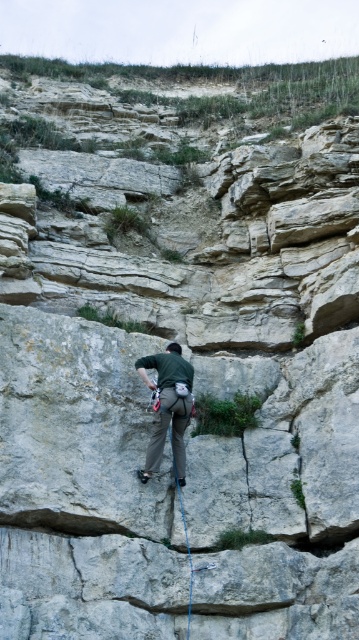
Question: Is green fabric climbing harness at center in front of blue nylon rope at center?

Choices:
 (A) no
 (B) yes

Answer: (A)

Question: Is green fabric climbing harness at center further to the viewer compared to blue nylon rope at center?

Choices:
 (A) yes
 (B) no

Answer: (A)

Question: Which point appears farthest from the camera in this image?

Choices:
 (A) (179, 490)
 (B) (179, 435)

Answer: (B)

Question: Which point is farther from the camera taking this photo?

Choices:
 (A) (161, 445)
 (B) (189, 609)

Answer: (A)

Question: Does green fabric climbing harness at center have a lesser width compared to blue nylon rope at center?

Choices:
 (A) no
 (B) yes

Answer: (A)